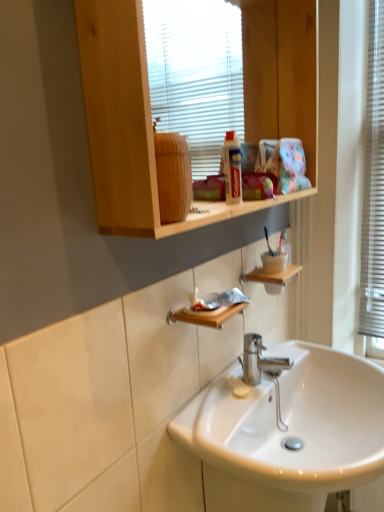
Question: From a real-world perspective, is white glossy sink at center above or below wooden soap dish at lower center, the first shelf viewed from the front?

Choices:
 (A) above
 (B) below

Answer: (B)

Question: Considering the positions of point (327, 360) and point (205, 313), is point (327, 360) closer or farther from the camera than point (205, 313)?

Choices:
 (A) farther
 (B) closer

Answer: (A)

Question: Estimate the real-world distances between objects in this image. Which object is closer to the wooden shelf at upper center?

Choices:
 (A) wooden soap dish at lower center, the first shelf viewed from the front
 (B) white glossy sink at center
 (C) white plastic window frame at right
 (D) wooden shelf at lower center, which is the 1th shelf in back-to-front order

Answer: (D)

Question: Which object is the closest to the white glossy sink at center?

Choices:
 (A) wooden shelf at lower center, the first shelf viewed from the top
 (B) wooden soap dish at lower center, the 2th shelf when ordered from right to left
 (C) white plastic window frame at right
 (D) wooden shelf at upper center

Answer: (B)